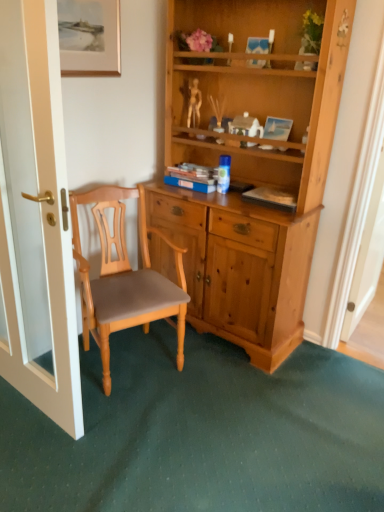
Question: From a real-world perspective, is white glossy door at left above or below blue glossy coffee cup at center?

Choices:
 (A) above
 (B) below

Answer: (B)

Question: From the image's perspective, is white glossy door at left located above or below blue glossy coffee cup at center?

Choices:
 (A) below
 (B) above

Answer: (A)

Question: Which object is the closest to the gold-framed painting at upper left?

Choices:
 (A) blue matte book at center
 (B) light brown wood chair at center
 (C) blue glossy coffee cup at center
 (D) white glossy door at left

Answer: (A)

Question: Which object is the farthest from the light brown wood chair at center?

Choices:
 (A) blue matte book at center
 (B) white glossy door at left
 (C) blue glossy coffee cup at center
 (D) gold-framed painting at upper left

Answer: (D)